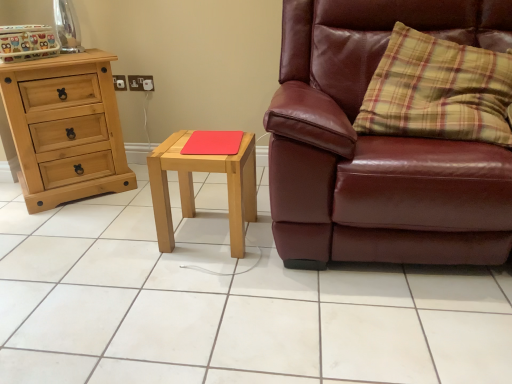
The image size is (512, 384). I want to click on free space to the left of light wood/matte nightstand at center, so coord(126,241).